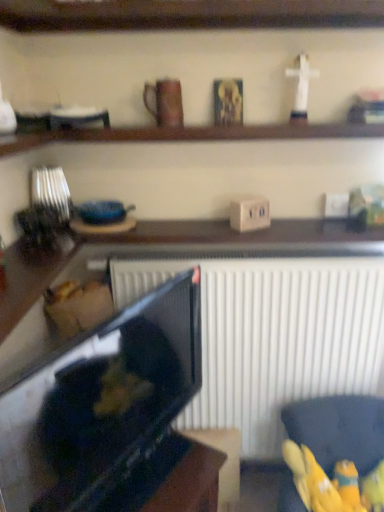
Identify the location of wooden shelf at upper center, which is counted as the first shelf, starting from the top. (188, 14).

At what (x,y) coordinates should I click in order to perform the action: click on yellow fabric toy at lower right, the 1th toy in the bottom-to-top sequence. Please return your answer as a coordinate pair (x, y). The width and height of the screenshot is (384, 512). Looking at the image, I should click on (348, 485).

In order to click on glossy black tv at lower left in this screenshot , I will do `click(170, 479)`.

Where is `wooden shelf at upper center, marked as the 1th shelf in a bottom-to-top arrangement`? Image resolution: width=384 pixels, height=512 pixels. wooden shelf at upper center, marked as the 1th shelf in a bottom-to-top arrangement is located at coordinates (190, 134).

Is wooden figurine at upper right, the second toy positioned from the top, with glossy black tv at lower left?

wooden figurine at upper right, the second toy positioned from the top, is not next to glossy black tv at lower left, and they're not touching.

Which object is closer to the camera, wooden figurine at upper right, the 3th toy in the bottom-to-top sequence, or glossy black tv at lower left?

glossy black tv at lower left is more forward.

What's the angular difference between wooden figurine at upper right, the 2th toy in the right-to-left sequence, and glossy black tv at lower left's facing directions?

55.6 degrees separate the facing orientations of wooden figurine at upper right, the 2th toy in the right-to-left sequence, and glossy black tv at lower left.

From a real-world perspective, is wooden figurine at upper right, the 3th toy in the bottom-to-top sequence, on top of glossy black tv at lower left?

Yes.

From the image's perspective, which one is positioned lower, white plastic cross at upper right, the first toy in the top-to-bottom sequence, or wooden shelf at upper center, the 2th shelf when ordered from top to bottom?

From the image's view, wooden shelf at upper center, the 2th shelf when ordered from top to bottom, is below.

In the image, there is a white plastic cross at upper right, which is counted as the first toy, starting from the left. Identify the location of shelf below it (from a real-world perspective). This screenshot has width=384, height=512. (190, 134).

Which of these two, white plastic cross at upper right, which is counted as the first toy, starting from the left, or wooden shelf at upper center, marked as the 1th shelf in a bottom-to-top arrangement, stands taller?

white plastic cross at upper right, which is counted as the first toy, starting from the left, is taller.

Is there a large distance between white plastic cross at upper right, the first toy in the top-to-bottom sequence, and wooden shelf at upper center, marked as the 1th shelf in a bottom-to-top arrangement?

They are positioned close to each other.

Does yellow fabric toy at lower right, the first toy viewed from the right, have a greater width compared to glossy black tv at lower left?

Incorrect, the width of yellow fabric toy at lower right, the first toy viewed from the right, does not surpass that of glossy black tv at lower left.

Is yellow fabric toy at lower right, which is the 4th toy from left to right, taller or shorter than glossy black tv at lower left?

yellow fabric toy at lower right, which is the 4th toy from left to right, is shorter than glossy black tv at lower left.

Is yellow fabric toy at lower right, which is counted as the 2th toy, starting from the bottom, far from glossy black tv at lower left?

yellow fabric toy at lower right, which is counted as the 2th toy, starting from the bottom, is actually quite close to glossy black tv at lower left.

Is yellow fabric toy at lower right, which is the 4th toy from left to right, located outside glossy black tv at lower left?

Absolutely, yellow fabric toy at lower right, which is the 4th toy from left to right, is external to glossy black tv at lower left.

This screenshot has height=512, width=384. In order to click on appliance lying in front of the white plastic cross at upper right, the 4th toy viewed from the right in this screenshot , I will do `click(101, 402)`.

Is white plastic cross at upper right, which is the 4th toy in bottom-to-top order, facing towards black glossy tv at center?

No, white plastic cross at upper right, which is the 4th toy in bottom-to-top order, is not turned towards black glossy tv at center.

Which object is closer to the camera, white plastic cross at upper right, the 4th toy viewed from the right, or black glossy tv at center?

black glossy tv at center is in front.

Looking at this image, which of these two, white plastic cross at upper right, the 4th toy viewed from the right, or black glossy tv at center, is wider?

Wider between the two is black glossy tv at center.

Based on the photo, is white plastic cross at upper right, which is the 4th toy in bottom-to-top order, at the left side of yellow fabric toy at lower right, which is the 4th toy from left to right?

Yes, white plastic cross at upper right, which is the 4th toy in bottom-to-top order, is to the left of yellow fabric toy at lower right, which is the 4th toy from left to right.

Measure the distance between white plastic cross at upper right, the 4th toy viewed from the right, and yellow fabric toy at lower right, which is counted as the 2th toy, starting from the bottom.

white plastic cross at upper right, the 4th toy viewed from the right, is 4.50 feet from yellow fabric toy at lower right, which is counted as the 2th toy, starting from the bottom.

Is white plastic cross at upper right, which is counted as the first toy, starting from the left, in front of or behind yellow fabric toy at lower right, arranged as the 3th toy when viewed from the top, in the image?

Clearly, white plastic cross at upper right, which is counted as the first toy, starting from the left, is in front of yellow fabric toy at lower right, arranged as the 3th toy when viewed from the top.

Is point (305, 100) farther from camera compared to point (374, 477)?

No, it is not.

Is yellow fabric bag at lower right placed right next to yellow fabric toy at lower right, the 1th toy in the bottom-to-top sequence?

Indeed, yellow fabric bag at lower right and yellow fabric toy at lower right, the 1th toy in the bottom-to-top sequence, are beside each other and touching.

Is yellow fabric bag at lower right taller or shorter than yellow fabric toy at lower right, the third toy viewed from the right?

Considering their sizes, yellow fabric bag at lower right has more height than yellow fabric toy at lower right, the third toy viewed from the right.

From a real-world perspective, who is located lower, yellow fabric bag at lower right or yellow fabric toy at lower right, the second toy in the left-to-right sequence?

yellow fabric toy at lower right, the second toy in the left-to-right sequence.

Could wooden figurine at upper right, the 3th toy in the bottom-to-top sequence, be considered to be inside brown matte mug at upper center?

No, brown matte mug at upper center does not contain wooden figurine at upper right, the 3th toy in the bottom-to-top sequence.

Does brown matte mug at upper center appear on the left side of wooden figurine at upper right, placed as the 3th toy when sorted from left to right?

Correct, you'll find brown matte mug at upper center to the left of wooden figurine at upper right, placed as the 3th toy when sorted from left to right.

From the image's perspective, does brown matte mug at upper center appear higher than wooden figurine at upper right, the second toy positioned from the top?

Yes.

This screenshot has height=512, width=384. Identify the location of the 1st toy behind the glossy black tv at lower left. (367, 106).

Find the location of a particular element. This screenshot has width=384, height=512. shelf located below the white plastic cross at upper right, the first toy in the top-to-bottom sequence (from the image's perspective) is located at coordinates (190, 134).

Based on the photo, estimate the real-world distances between objects in this image. Which object is closer to black glossy tv at center, white plastic cross at upper right, the 4th toy viewed from the right, or yellow fabric toy at lower right, the third toy viewed from the right?

Based on the image, yellow fabric toy at lower right, the third toy viewed from the right, appears to be nearer to black glossy tv at center.

Estimate the real-world distances between objects in this image. Which object is closer to yellow fabric toy at lower right, the 4th toy in the top-to-bottom sequence, white plastic cross at upper right, the first toy in the top-to-bottom sequence, or yellow fabric bag at lower right?

yellow fabric bag at lower right is closer to yellow fabric toy at lower right, the 4th toy in the top-to-bottom sequence.

Looking at the image, which one is located closer to glossy black tv at lower left, yellow fabric toy at lower right, the second toy in the left-to-right sequence, or wooden shelf at upper center, marked as the 1th shelf in a bottom-to-top arrangement?

Based on the image, yellow fabric toy at lower right, the second toy in the left-to-right sequence, appears to be nearer to glossy black tv at lower left.

When comparing their distances from wooden shelf at upper center, marked as the 1th shelf in a bottom-to-top arrangement, does white plastic cross at upper right, which is the 4th toy in bottom-to-top order, or yellow fabric toy at lower right, the 4th toy in the top-to-bottom sequence, seem closer?

white plastic cross at upper right, which is the 4th toy in bottom-to-top order, lies closer to wooden shelf at upper center, marked as the 1th shelf in a bottom-to-top arrangement, than the other object.

Looking at the image, which one is located further to yellow fabric bag at lower right, yellow fabric toy at lower right, the first toy viewed from the right, or wooden shelf at upper center, which is counted as the first shelf, starting from the top?

The object further to yellow fabric bag at lower right is wooden shelf at upper center, which is counted as the first shelf, starting from the top.

When comparing their distances from glossy black tv at lower left, does yellow fabric bag at lower right or wooden shelf at upper center, marked as the 1th shelf in a bottom-to-top arrangement, seem closer?

yellow fabric bag at lower right.

Based on their spatial positions, is wooden shelf at upper center, the 2th shelf in the bottom-to-top sequence, or wooden shelf at upper center, the 2th shelf when ordered from top to bottom, closer to white plastic cross at upper right, the 4th toy viewed from the right?

Based on the image, wooden shelf at upper center, the 2th shelf when ordered from top to bottom, appears to be nearer to white plastic cross at upper right, the 4th toy viewed from the right.

When comparing their distances from glossy black tv at lower left, does wooden shelf at upper center, which is counted as the first shelf, starting from the top, or wooden shelf at upper center, the 2th shelf when ordered from top to bottom, seem further?

wooden shelf at upper center, which is counted as the first shelf, starting from the top.

Locate an element on the screen. This screenshot has width=384, height=512. toy between white plastic cross at upper right, the first toy in the top-to-bottom sequence, and black glossy tv at center from top to bottom is located at coordinates (367, 106).

The width and height of the screenshot is (384, 512). Identify the location of shelf between wooden shelf at upper center, which is counted as the first shelf, starting from the top, and yellow fabric toy at lower right, the 4th toy in the top-to-bottom sequence, vertically. (190, 134).

This screenshot has width=384, height=512. I want to click on shelf between white plastic cross at upper right, the first toy in the top-to-bottom sequence, and yellow fabric toy at lower right, the 4th toy in the top-to-bottom sequence, vertically, so click(190, 134).

You are a GUI agent. You are given a task and a screenshot of the screen. Output one action in this format:
    pyautogui.click(x=<x>, y=<y>)
    Task: Click on the mug between wooden shelf at upper center, which is counted as the first shelf, starting from the top, and yellow fabric toy at lower right, arranged as the 3th toy when viewed from the top, in the up-down direction
    The height and width of the screenshot is (512, 384).
    Given the screenshot: What is the action you would take?
    pyautogui.click(x=164, y=102)